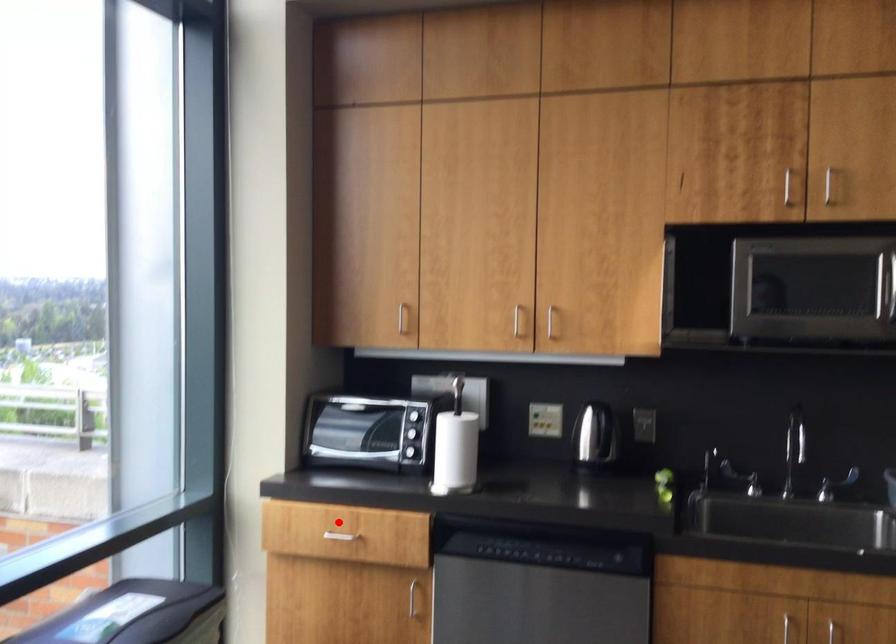
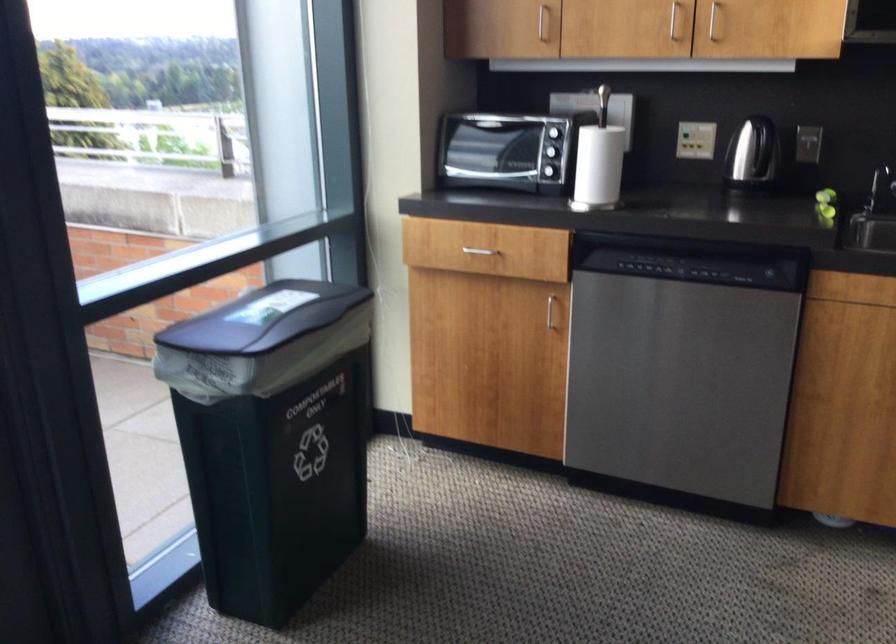
The point at the highlighted location is marked in the first image. Where is the corresponding point in the second image?

(474, 241)